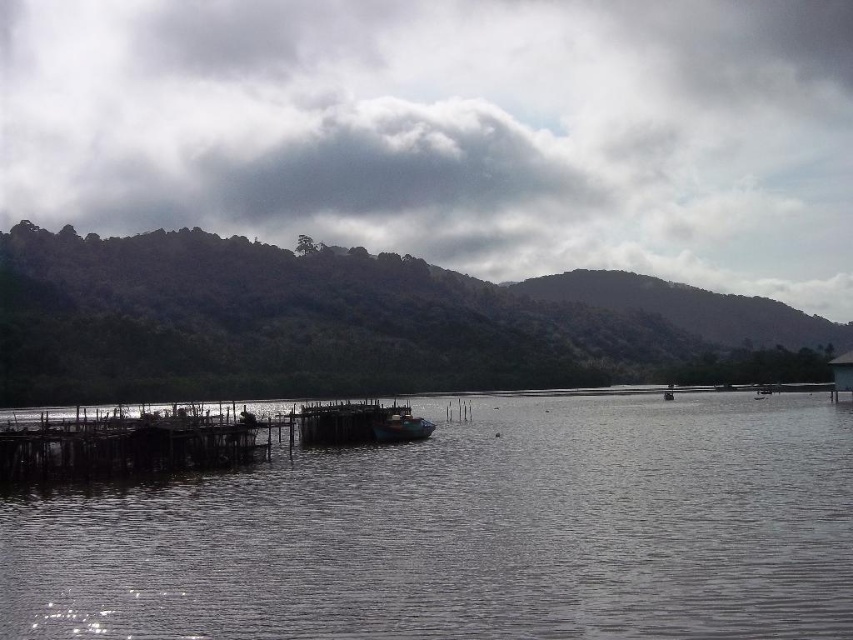
Is point (851, 296) farther from camera compared to point (357, 429)?

Yes, point (851, 296) is behind point (357, 429).

Consider the image. Who is positioned more to the right, cloudy sky at upper center or wooden dock at lower left?

Positioned to the right is cloudy sky at upper center.

This screenshot has height=640, width=853. Identify the location of cloudy sky at upper center. (450, 131).

The image size is (853, 640). In order to click on cloudy sky at upper center in this screenshot , I will do `click(450, 131)`.

Does point (305, 420) lie behind point (395, 422)?

Yes, point (305, 420) is farther from viewer.

Is wooden dock at center below wooden boat at center?

No, wooden dock at center is not below wooden boat at center.

Identify the location of wooden dock at center. The image size is (853, 640). (351, 422).

The width and height of the screenshot is (853, 640). In order to click on wooden dock at center in this screenshot , I will do `click(351, 422)`.

Can you confirm if wooden dock at lower left is positioned above wooden boat at center?

No.

Is wooden dock at lower left bigger than wooden boat at center?

Indeed, wooden dock at lower left has a larger size compared to wooden boat at center.

Between point (131, 467) and point (403, 417), which one is positioned behind?

Positioned behind is point (403, 417).

I want to click on wooden dock at lower left, so click(x=170, y=438).